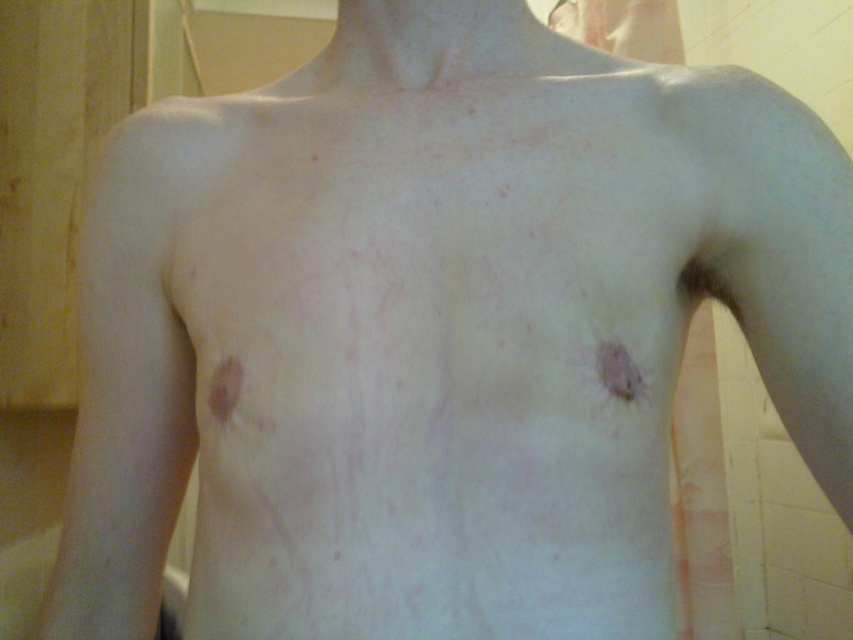
Does pink matte scar at center have a smaller size compared to brown matte freckle at left?

Yes.

From the picture: Who is more distant from viewer, (616, 368) or (219, 419)?

Point (219, 419)

Which is behind, point (602, 385) or point (213, 404)?

The point (213, 404) is behind.

Image resolution: width=853 pixels, height=640 pixels. In order to click on pink matte scar at center in this screenshot , I will do `click(618, 371)`.